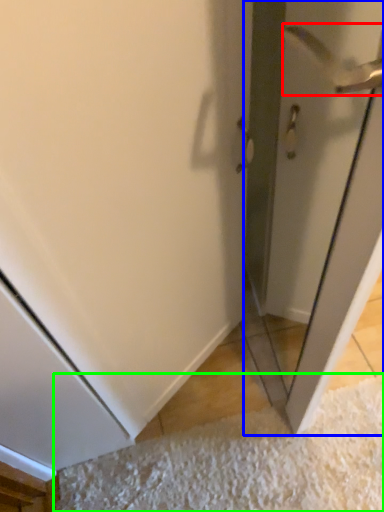
Question: Which is nearer to the door handle (highlighted by a red box)? screen door (highlighted by a blue box) or doormat (highlighted by a green box).

Choices:
 (A) screen door
 (B) doormat

Answer: (A)